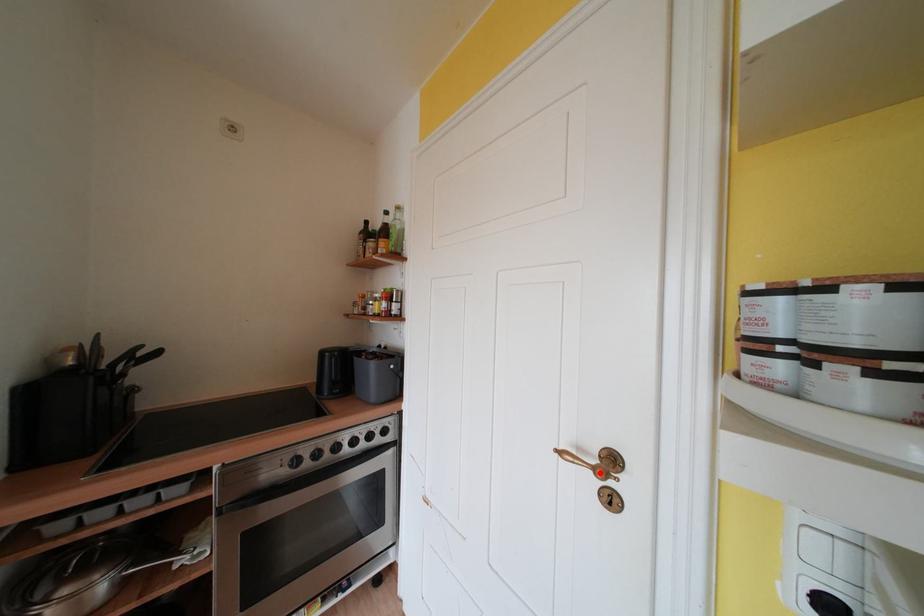
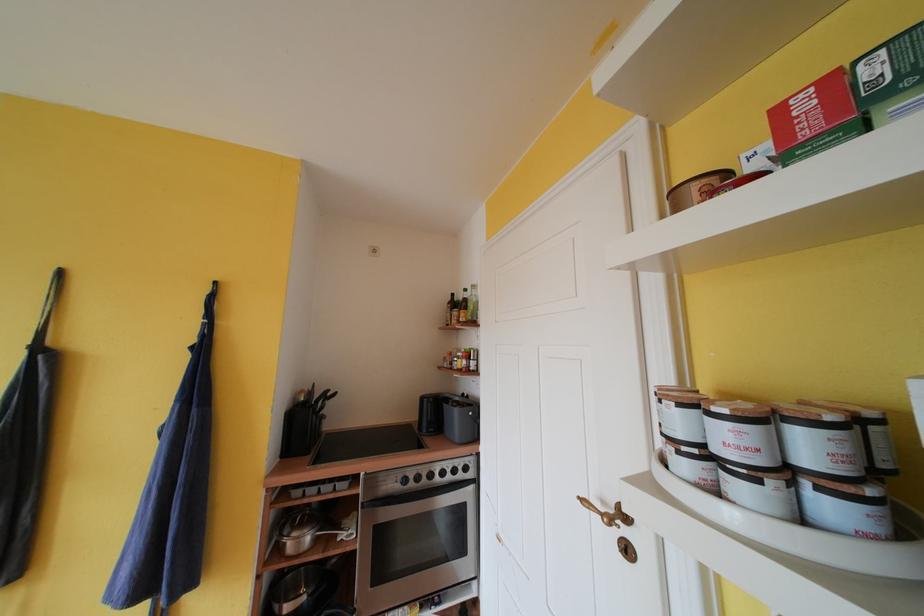
The point at the highlighted location is marked in the first image. Where is the corresponding point in the second image?

(609, 519)